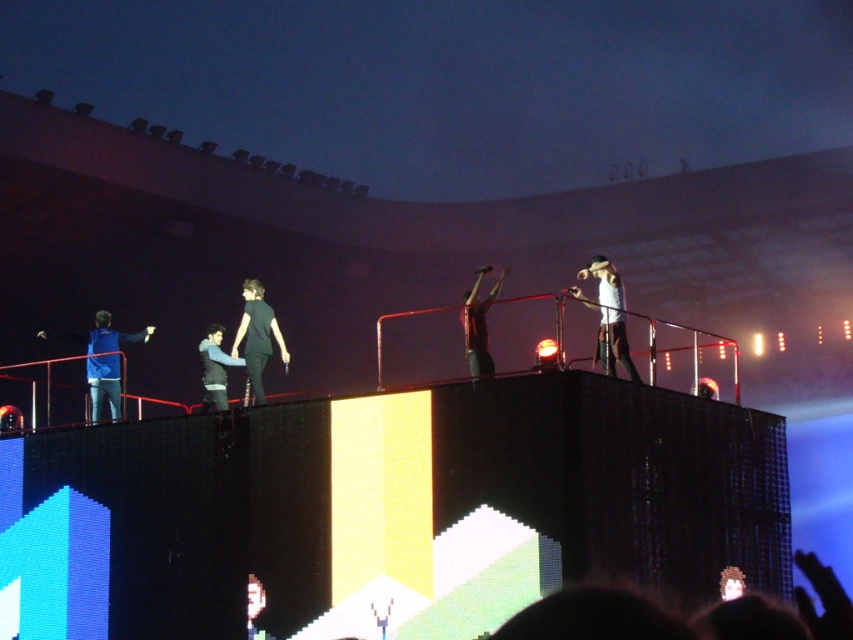
Question: Estimate the real-world distances between objects in this image. Which object is closer to the black matte shirt at center?

Choices:
 (A) white matte shirt at upper right
 (B) red matte shirt at center
 (C) shiny gold hair at center

Answer: (B)

Question: Does white matte shirt at upper right have a lesser width compared to red matte shirt at center?

Choices:
 (A) no
 (B) yes

Answer: (A)

Question: Is black matte shirt at center closer to the viewer compared to smooth skin face at lower left?

Choices:
 (A) yes
 (B) no

Answer: (B)

Question: Can you confirm if red matte shirt at center is positioned to the left of shiny gold hair at center?

Choices:
 (A) no
 (B) yes

Answer: (B)

Question: Which object is farther from the camera taking this photo?

Choices:
 (A) smooth skin face at lower left
 (B) red matte shirt at center
 (C) black matte shirt at center

Answer: (C)

Question: Which object is farther from the camera taking this photo?

Choices:
 (A) black leather jacket at center
 (B) blue fabric jacket at left

Answer: (B)